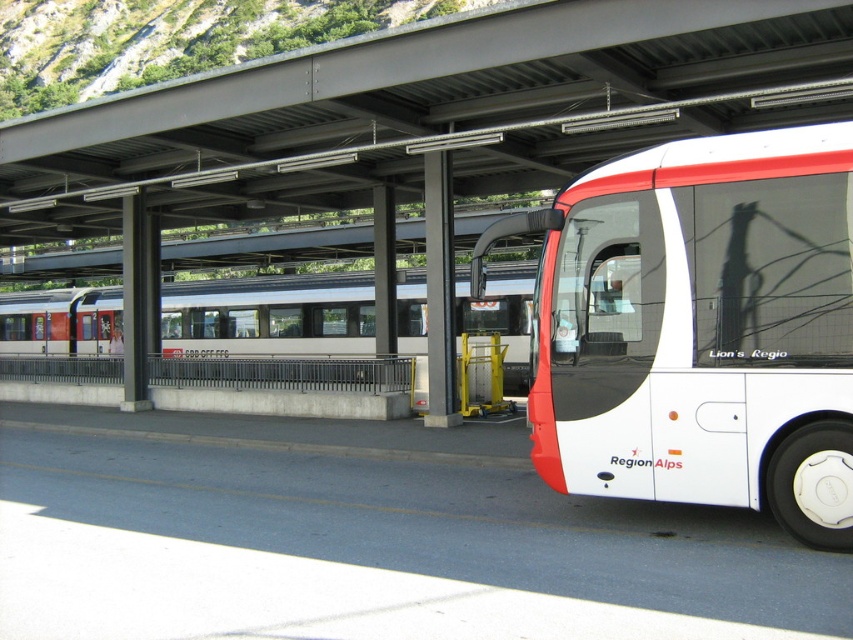
Consider the image. You are a traveler at the station and need to choose between taking the white matte bus at right and the silver metallic train at center for your journey. Based on their sizes, which one might offer more seating space?

The silver metallic train at center is larger than the white matte bus at right, so it likely offers more seating space.